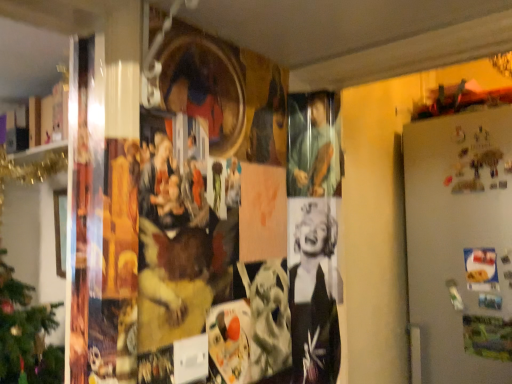
Where is `white matte refrigerator at right`? white matte refrigerator at right is located at coordinates (460, 245).

The width and height of the screenshot is (512, 384). Describe the element at coordinates (460, 245) in the screenshot. I see `white matte refrigerator at right` at that location.

Where is `white matte refrigerator at right`? white matte refrigerator at right is located at coordinates (460, 245).